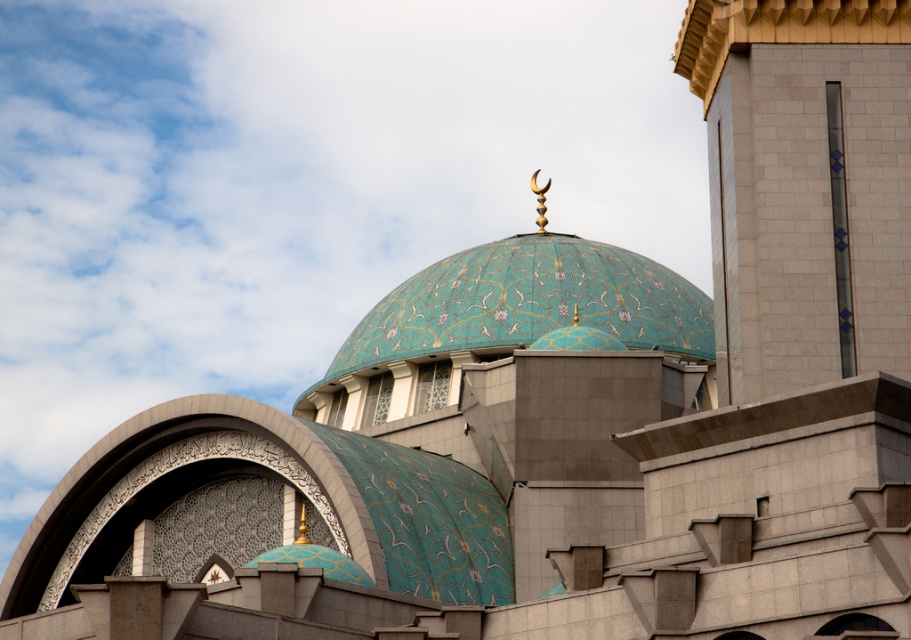
Locate an element on the screen. smooth beige tower at upper right is located at coordinates (804, 186).

Is point (812, 177) less distant than point (539, 195)?

That is True.

At what (x,y) coordinates should I click in order to perform the action: click on smooth beige tower at upper right. Please return your answer as a coordinate pair (x, y). The image size is (911, 640). Looking at the image, I should click on (804, 186).